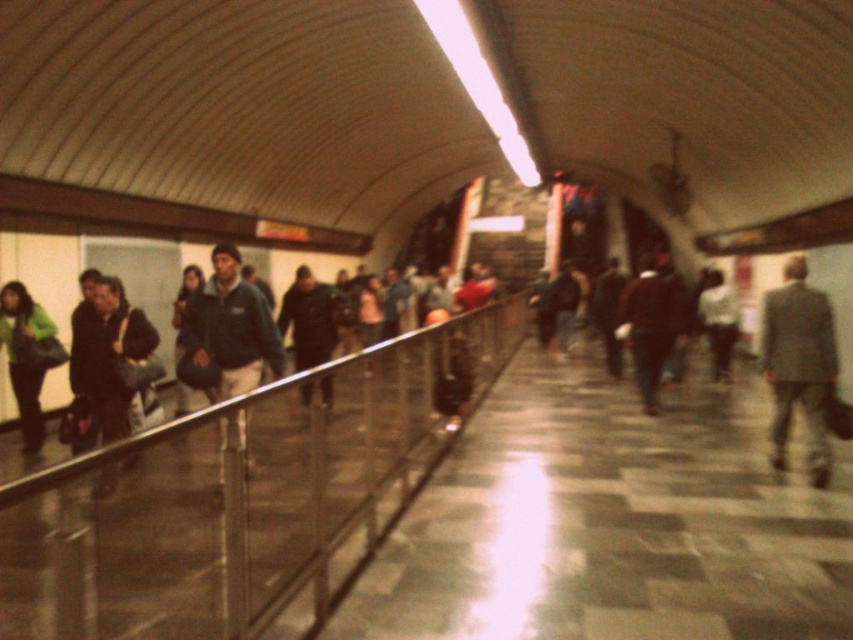
Is matte blue jacket at center smaller than green fabric jacket at left?

Indeed, matte blue jacket at center has a smaller size compared to green fabric jacket at left.

Is point (228, 380) in front of point (9, 348)?

That is True.

Find the location of a particular element. The height and width of the screenshot is (640, 853). matte blue jacket at center is located at coordinates (230, 330).

This screenshot has width=853, height=640. Find the location of `metallic silver rail at left`. metallic silver rail at left is located at coordinates (242, 497).

Does metallic silver rail at left appear on the right side of green fabric jacket at left?

Correct, you'll find metallic silver rail at left to the right of green fabric jacket at left.

What do you see at coordinates (242, 497) in the screenshot? I see `metallic silver rail at left` at bounding box center [242, 497].

You are a GUI agent. You are given a task and a screenshot of the screen. Output one action in this format:
    pyautogui.click(x=<x>, y=<y>)
    Task: Click on the metallic silver rail at left
    This screenshot has width=853, height=640.
    Given the screenshot: What is the action you would take?
    pyautogui.click(x=242, y=497)

Can you confirm if gray suit at right is wider than green fabric jacket at left?

In fact, gray suit at right might be narrower than green fabric jacket at left.

How much distance is there between gray suit at right and green fabric jacket at left?

They are 6.59 meters apart.

Who is more distant from viewer, (781, 449) or (19, 300)?

The point (19, 300) is more distant.

You are a GUI agent. You are given a task and a screenshot of the screen. Output one action in this format:
    pyautogui.click(x=<x>, y=<y>)
    Task: Click on the gray suit at right
    This screenshot has width=853, height=640.
    Given the screenshot: What is the action you would take?
    pyautogui.click(x=799, y=364)